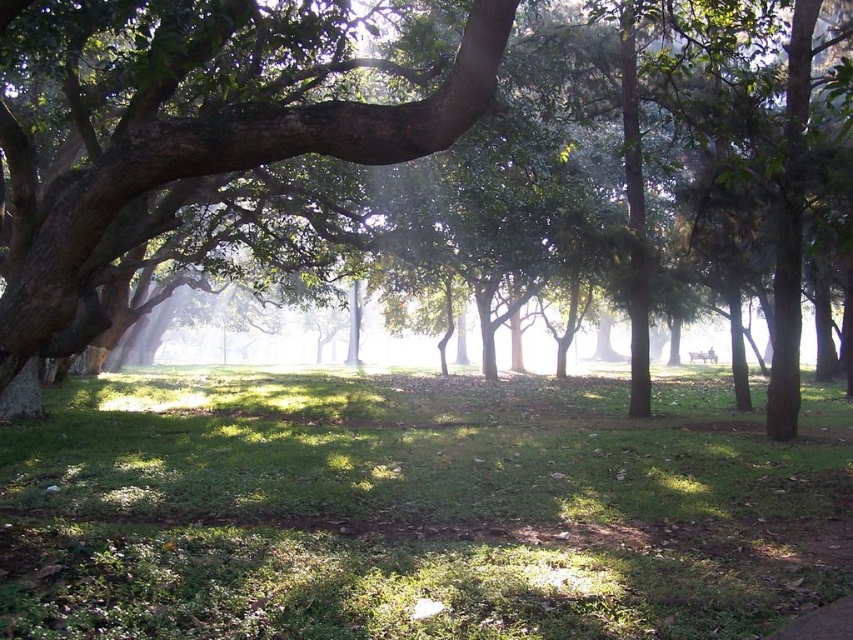
You are a gardener who wants to plant a new flower bed in the park. You have two options for locations based on the image provided. The first option is near the green grassy at center, and the second is near the green leafy tree at center. Considering their sizes, which location would provide more space for the flower bed?

The green leafy tree at center is larger than the green grassy at center. Therefore, the area near the green grassy at center would provide more space for the flower bed since it is smaller and less obstructive.

You are a gardener who wants to plant a new flower bed between the green grassy at center and the green leafy tree at center. Based on their positions, which object should you start working closer to first?

Since the green grassy at center is in front of the green leafy tree at center, you should start working closer to the green grassy at center first as it is nearer to your current position.